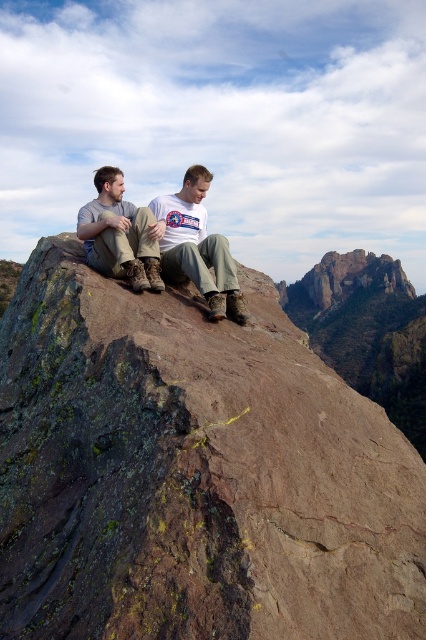
Does matte brown boots at left have a greater height compared to rugged stone peak at center?

Incorrect, matte brown boots at left's height is not larger of rugged stone peak at center's.

Which is above, matte brown boots at left or rugged stone peak at center?

rugged stone peak at center is above.

At what (x,y) coordinates should I click in order to perform the action: click on matte brown boots at left. Please return your answer as a coordinate pair (x, y). Looking at the image, I should click on (120, 234).

Does rusty rock at center appear on the left side of matte brown boots at left?

No, rusty rock at center is not to the left of matte brown boots at left.

Find the location of a particular element. This screenshot has height=640, width=426. rusty rock at center is located at coordinates (192, 474).

Between white t-shirt at center and rugged stone peak at center, which one is positioned lower?

Positioned lower is white t-shirt at center.

Is white t-shirt at center wider than rugged stone peak at center?

In fact, white t-shirt at center might be narrower than rugged stone peak at center.

Between point (184, 202) and point (354, 276), which one is positioned in front?

Point (184, 202)

The image size is (426, 640). In order to click on white t-shirt at center in this screenshot , I will do `click(198, 248)`.